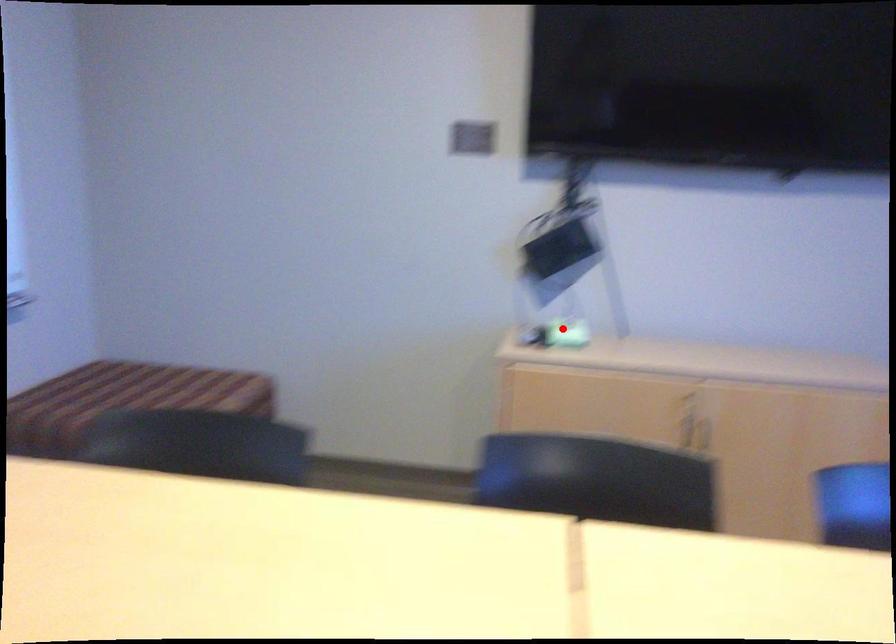
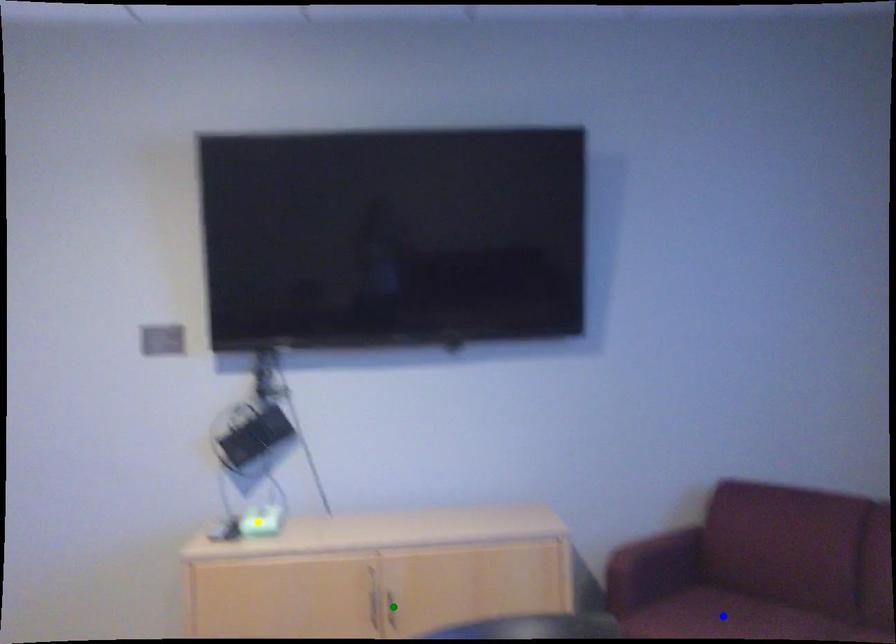
Question: I am providing you with two images of the same scene from different viewpoints. A red point is marked on the first image. You are given multiple points on the second image. Can you choose the point in image 2 that corresponds to the point in image 1?

Choices:
 (A) green point
 (B) blue point
 (C) yellow point

Answer: (C)